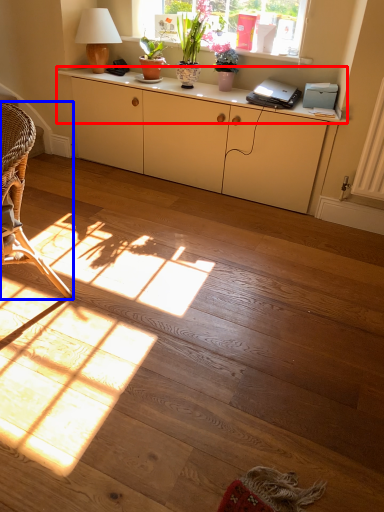
Question: Which point is closer to the camera, desk (highlighted by a red box) or chair (highlighted by a blue box)?

Choices:
 (A) desk
 (B) chair

Answer: (B)